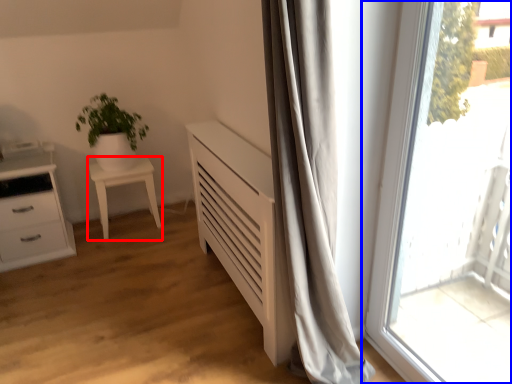
Question: Which point is closer to the camera, furniture (highlighted by a red box) or window (highlighted by a blue box)?

Choices:
 (A) furniture
 (B) window

Answer: (B)